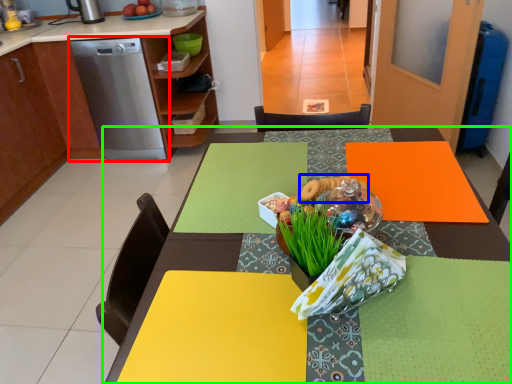
Question: Estimate the real-world distances between objects in this image. Which object is closer to home appliance (highlighted by a red box), food (highlighted by a blue box) or table (highlighted by a green box)?

Choices:
 (A) food
 (B) table

Answer: (A)